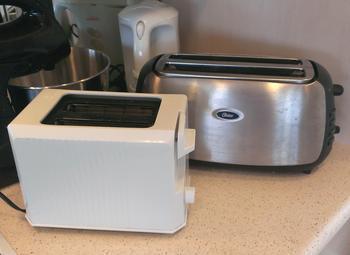
Image resolution: width=350 pixels, height=255 pixels. Identify the location of mixing bowl. [x=78, y=69].